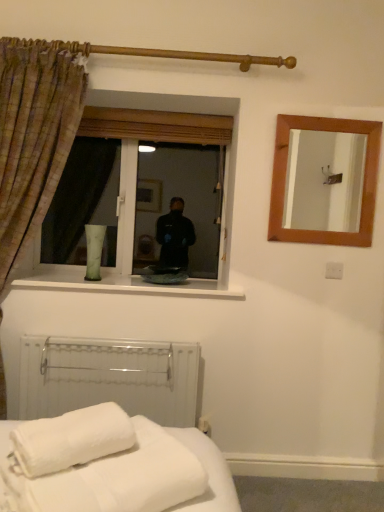
Question: Considering the relative sizes of wooden mirror at upper right and white soft towel at lower left in the image provided, is wooden mirror at upper right thinner than white soft towel at lower left?

Choices:
 (A) no
 (B) yes

Answer: (B)

Question: Is wooden mirror at upper right facing towards white soft towel at lower left?

Choices:
 (A) yes
 (B) no

Answer: (B)

Question: Is wooden mirror at upper right not close to white soft towel at lower left?

Choices:
 (A) yes
 (B) no

Answer: (A)

Question: Can you confirm if wooden mirror at upper right is smaller than white soft towel at lower left?

Choices:
 (A) yes
 (B) no

Answer: (A)

Question: From the image's perspective, would you say wooden mirror at upper right is shown under white soft towel at lower left?

Choices:
 (A) yes
 (B) no

Answer: (B)

Question: Considering the relative positions of wooden mirror at upper right and white soft towel at lower left in the image provided, is wooden mirror at upper right to the left of white soft towel at lower left from the viewer's perspective?

Choices:
 (A) no
 (B) yes

Answer: (A)

Question: Is plaid fabric curtain at left surrounded by wooden mirror at upper right?

Choices:
 (A) no
 (B) yes

Answer: (A)

Question: Does wooden mirror at upper right have a greater width compared to plaid fabric curtain at left?

Choices:
 (A) no
 (B) yes

Answer: (A)

Question: Does wooden mirror at upper right have a smaller size compared to plaid fabric curtain at left?

Choices:
 (A) no
 (B) yes

Answer: (B)

Question: Can you confirm if wooden mirror at upper right is thinner than plaid fabric curtain at left?

Choices:
 (A) no
 (B) yes

Answer: (B)

Question: Is wooden mirror at upper right next to plaid fabric curtain at left and touching it?

Choices:
 (A) no
 (B) yes

Answer: (A)

Question: Are wooden mirror at upper right and plaid fabric curtain at left far apart?

Choices:
 (A) no
 (B) yes

Answer: (B)

Question: Is plaid fabric curtain at left positioned behind transparent glass window at center?

Choices:
 (A) no
 (B) yes

Answer: (A)